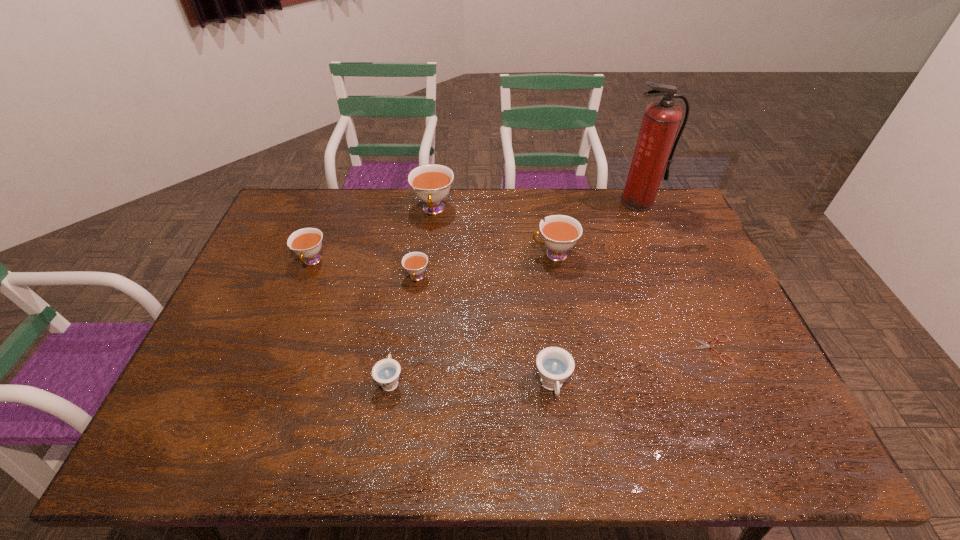
This screenshot has height=540, width=960. I want to click on the left blue teacup, so point(386,372).

The image size is (960, 540). In order to click on shears in this screenshot , I will do `click(705, 345)`.

The width and height of the screenshot is (960, 540). I want to click on the third nearest object, so click(705, 345).

The width and height of the screenshot is (960, 540). Identify the location of vacant space located at the nozzle of the fire extinguisher. (652, 237).

This screenshot has height=540, width=960. I want to click on free space located 0.210m on the side of the tallest teacup with the handle, so click(426, 268).

Find the location of `vacant space located on the side of the fifth shortest teacup with the handle`. vacant space located on the side of the fifth shortest teacup with the handle is located at coordinates (463, 254).

Where is `vacant area situated 0.130m on the side of the fifth shortest teacup with the handle`? The image size is (960, 540). vacant area situated 0.130m on the side of the fifth shortest teacup with the handle is located at coordinates (491, 254).

Locate an element on the screen. The height and width of the screenshot is (540, 960). vacant region located 0.400m on the side of the fifth shortest teacup with the handle is located at coordinates (407, 254).

Identify the location of vacant point located on the side of the third biggest white teacup with the handle. (291, 318).

This screenshot has height=540, width=960. I want to click on vacant space situated 0.060m on the side of the bigger blue teacup with the handle, so click(x=558, y=432).